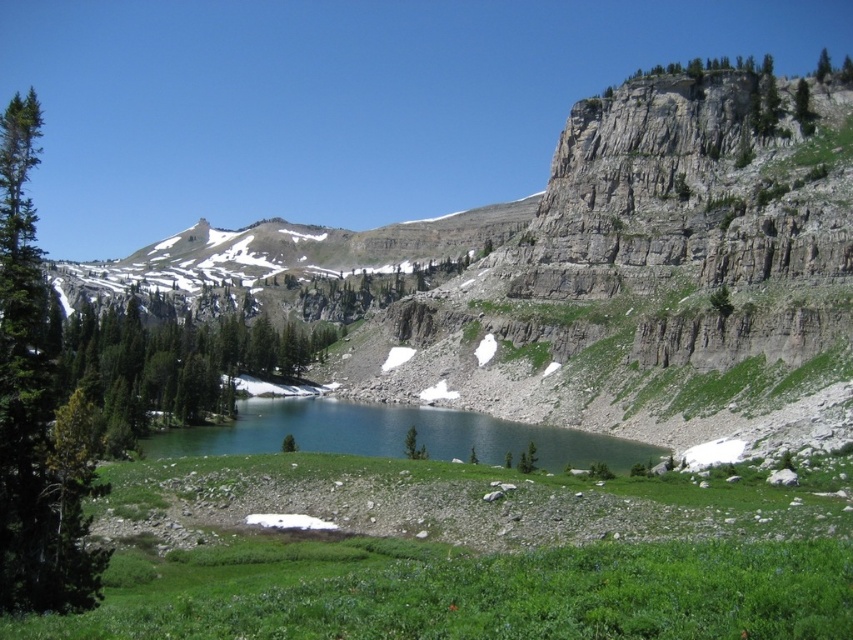
Question: Which object appears closest to the camera in this image?

Choices:
 (A) green textured tree at left
 (B) green grassy mountain lake at center
 (C) green textured tree at upper right

Answer: (A)

Question: Considering the real-world distances, which object is closest to the green textured tree at left?

Choices:
 (A) green grassy mountain lake at center
 (B) green leafy tree at center

Answer: (B)

Question: Does green textured tree at left appear on the right side of green textured tree at upper right?

Choices:
 (A) yes
 (B) no

Answer: (B)

Question: Where is green textured tree at left located in relation to green leafy tree at center in the image?

Choices:
 (A) below
 (B) above

Answer: (B)

Question: Does green leafy tree at center appear on the left side of green textured tree at upper right?

Choices:
 (A) no
 (B) yes

Answer: (B)

Question: Which point is closer to the camera?

Choices:
 (A) green textured tree at left
 (B) green textured tree at upper right
 (C) green leafy tree at center

Answer: (A)